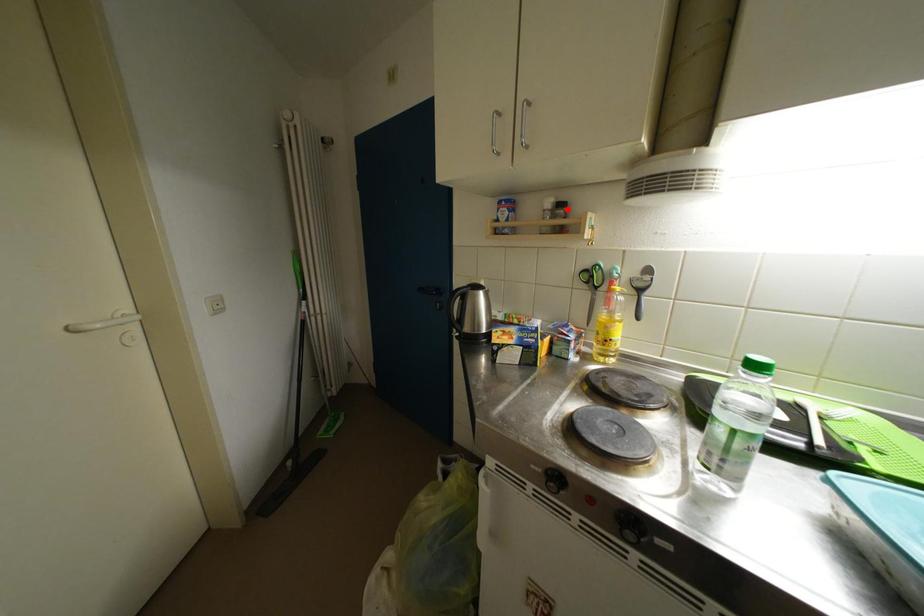
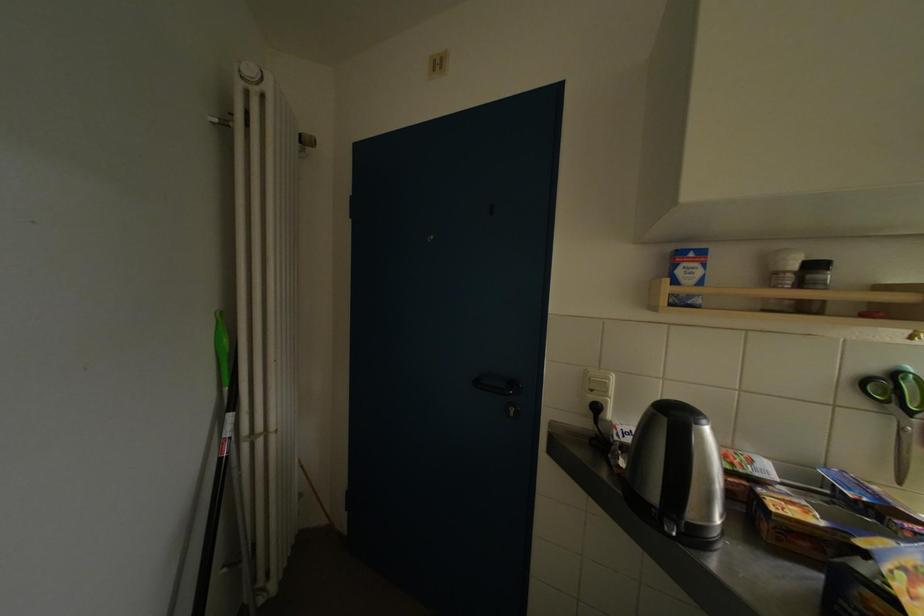
In the second image, find the point that corresponds to the highlighted location in the first image.

(821, 270)